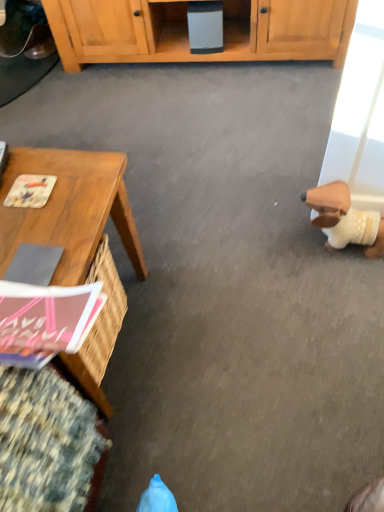
Question: From a real-world perspective, is brown plush toy at right located higher than wooden desk at left?

Choices:
 (A) no
 (B) yes

Answer: (A)

Question: Does brown plush toy at right have a greater width compared to wooden desk at left?

Choices:
 (A) yes
 (B) no

Answer: (B)

Question: Would you say brown plush toy at right is a long distance from wooden desk at left?

Choices:
 (A) yes
 (B) no

Answer: (B)

Question: Is brown plush toy at right beside wooden desk at left?

Choices:
 (A) no
 (B) yes

Answer: (A)

Question: Is brown plush toy at right at the right side of wooden desk at left?

Choices:
 (A) yes
 (B) no

Answer: (A)

Question: Is point coord(52,309) closer or farther from the camera than point coord(26,198)?

Choices:
 (A) farther
 (B) closer

Answer: (B)

Question: Would you say pink matte magazine at lower left, the second magazine when ordered from back to front, is inside or outside printed paper magazine at left, which appears as the 1th magazine when viewed from the top?

Choices:
 (A) inside
 (B) outside

Answer: (B)

Question: Is pink matte magazine at lower left, which is the second magazine from top to bottom, taller or shorter than printed paper magazine at left, the 2th magazine viewed from the front?

Choices:
 (A) tall
 (B) short

Answer: (A)

Question: Is pink matte magazine at lower left, the second magazine when ordered from back to front, to the left or to the right of printed paper magazine at left, the 2th magazine viewed from the front, in the image?

Choices:
 (A) right
 (B) left

Answer: (A)

Question: Is printed paper magazine at left, which is the 2th magazine in bottom-to-top order, inside the boundaries of wooden desk at left, or outside?

Choices:
 (A) outside
 (B) inside

Answer: (B)

Question: Does point (24, 184) appear closer or farther from the camera than point (81, 269)?

Choices:
 (A) farther
 (B) closer

Answer: (A)

Question: From the image's perspective, is printed paper magazine at left, the 2th magazine viewed from the front, located above or below wooden desk at left?

Choices:
 (A) above
 (B) below

Answer: (A)

Question: Considering their positions, is printed paper magazine at left, the 2th magazine viewed from the front, located in front of or behind wooden desk at left?

Choices:
 (A) behind
 (B) front

Answer: (A)

Question: Based on their sizes in the image, would you say printed paper magazine at left, which appears as the 1th magazine when viewed from the top, is bigger or smaller than brown plush toy at right?

Choices:
 (A) small
 (B) big

Answer: (A)

Question: From the image's perspective, is printed paper magazine at left, the 1th magazine when ordered from back to front, above or below brown plush toy at right?

Choices:
 (A) below
 (B) above

Answer: (B)